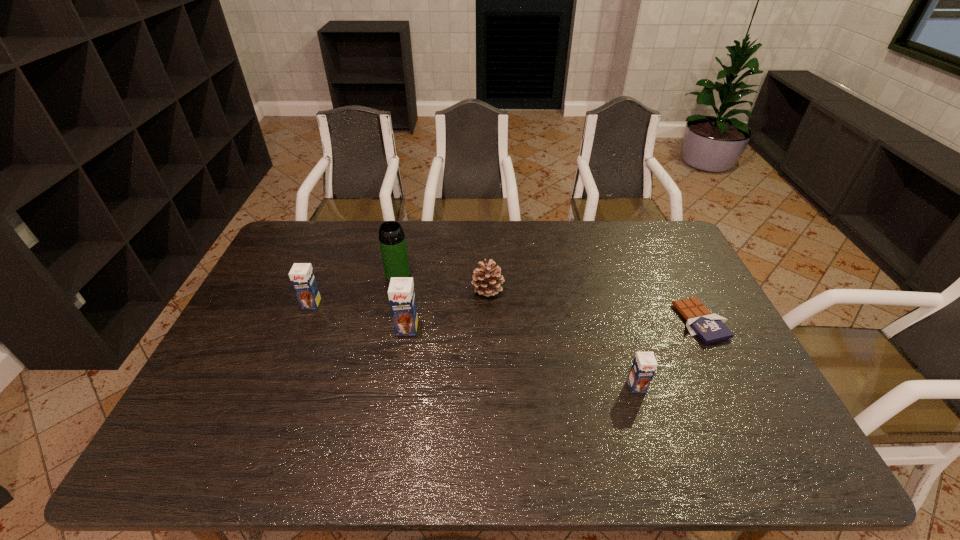
Please point a space for a new chocolate_milk to maintain equal intervals. Please provide its 2D coordinates. Your answer should be formatted as a tuple, i.e. [(x, y)], where the tuple contains the x and y coordinates of a point satisfying the conditions above.

[(515, 355)]